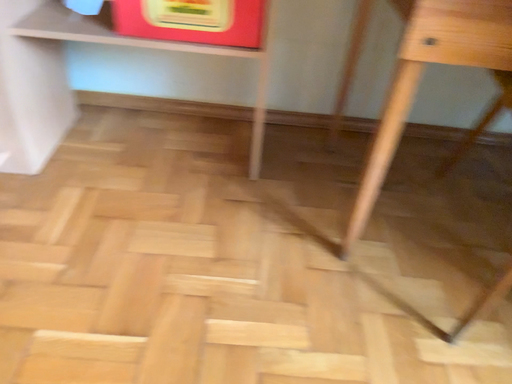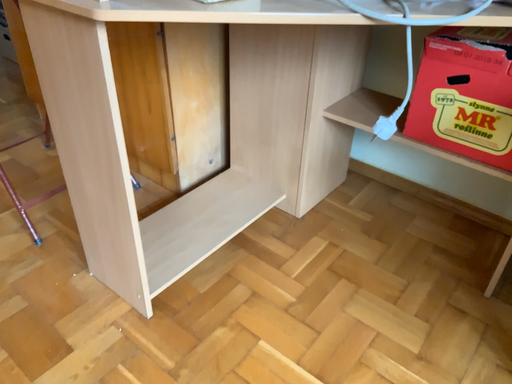
Question: How did the camera likely rotate when shooting the video?

Choices:
 (A) rotated left
 (B) rotated right

Answer: (A)